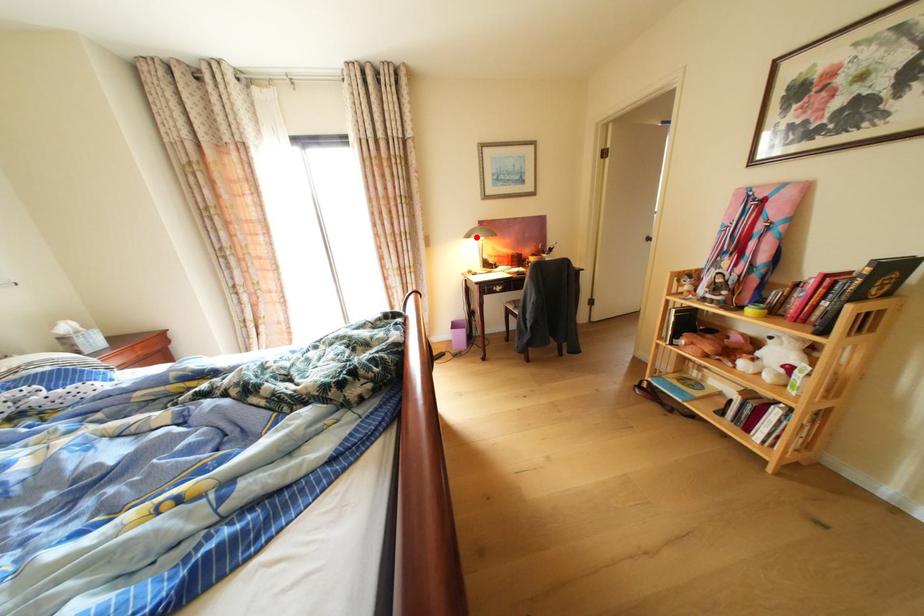
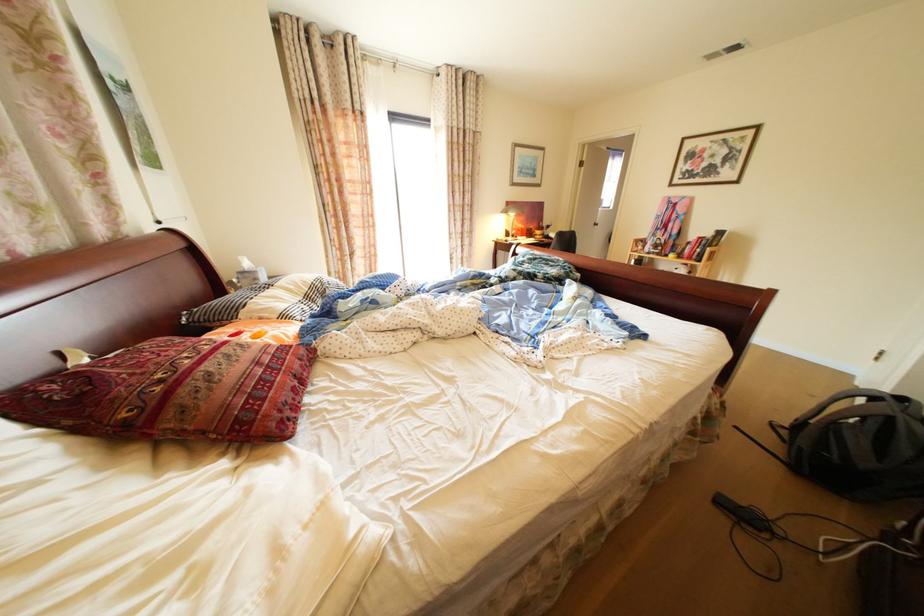
Question: A red point is marked in image1. In image2, is the corresponding 3D point closer to the camera or farther? Reply with the corresponding letter.

Choices:
 (A) The corresponding 3D point is closer.
 (B) The corresponding 3D point is farther.

Answer: (A)